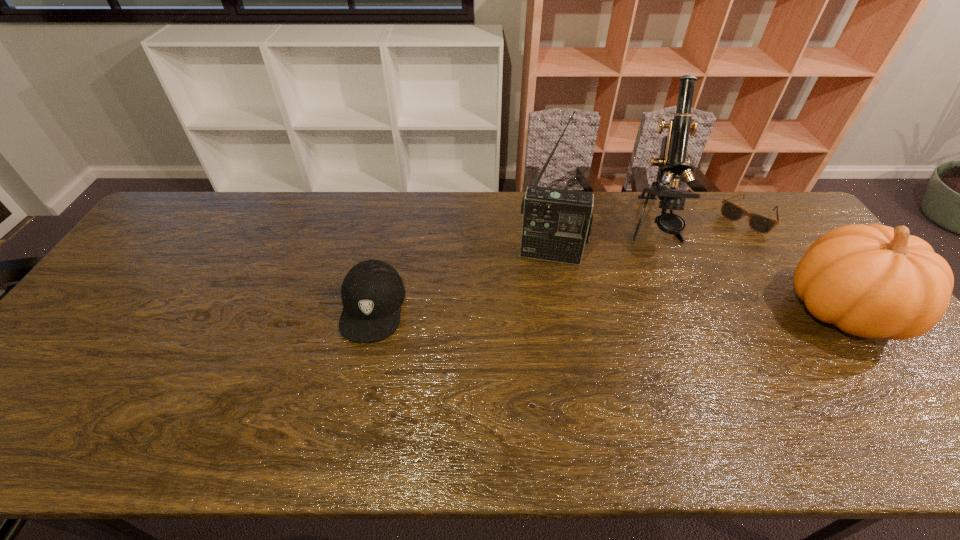
I want to click on vacant space situated through the eyepiece of the microscope, so click(669, 292).

This screenshot has width=960, height=540. What are the coordinates of `blank space located on the frames of the shortest object` in the screenshot? It's located at tap(724, 247).

This screenshot has width=960, height=540. Find the location of `free space located on the frames of the shortest object`. free space located on the frames of the shortest object is located at coordinates (731, 239).

What are the coordinates of `free space located 0.070m on the frames of the shortest object` in the screenshot? It's located at (729, 241).

At what (x,y) coordinates should I click in order to perform the action: click on vacant point located 0.230m on the display of the radio receiver. Please return your answer as a coordinate pair (x, y). The image size is (960, 540). Looking at the image, I should click on 538,325.

Where is `blank space located on the display of the radio receiver`? blank space located on the display of the radio receiver is located at coordinates (539, 322).

You are a GUI agent. You are given a task and a screenshot of the screen. Output one action in this format:
    pyautogui.click(x=<x>, y=<y>)
    Task: Click on the vacant space located 0.160m on the display of the radio receiver
    Image resolution: width=960 pixels, height=540 pixels.
    Given the screenshot: What is the action you would take?
    pyautogui.click(x=540, y=305)

Image resolution: width=960 pixels, height=540 pixels. Find the location of `microscope that is at the far edge`. microscope that is at the far edge is located at coordinates (672, 162).

Locate an element on the screen. sunglasses located in the far edge section of the desktop is located at coordinates (761, 224).

At what (x,y) coordinates should I click in order to perform the action: click on pumpkin that is at the right edge. Please return your answer as a coordinate pair (x, y). Looking at the image, I should click on (874, 281).